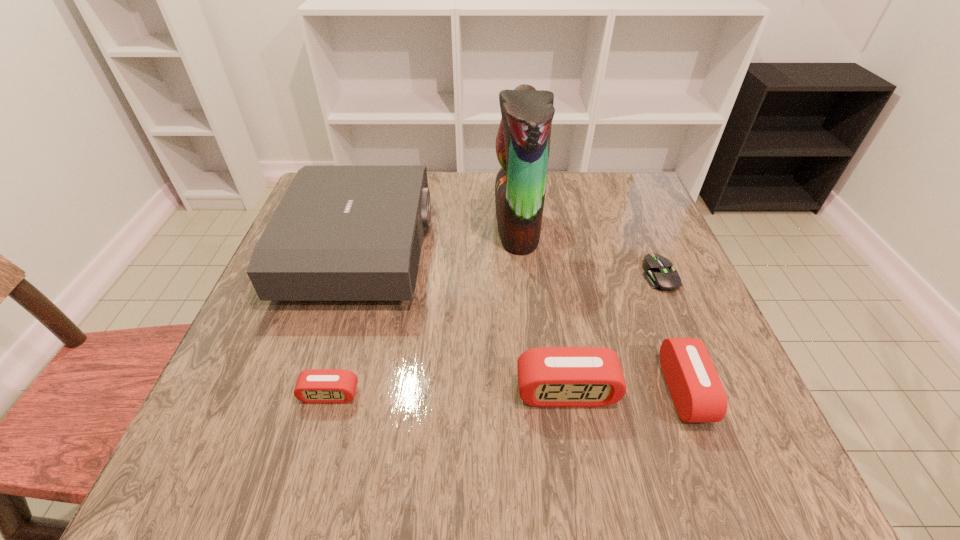
Identify the location of free space between the projector and the third shortest object. (523, 320).

The image size is (960, 540). I want to click on free spot between the shortest object and the third shortest object, so click(x=672, y=333).

You are a GUI agent. You are given a task and a screenshot of the screen. Output one action in this format:
    pyautogui.click(x=<x>, y=<y>)
    Task: Click on the unoccupied position between the second shortest alarm clock and the tallest object
    The height and width of the screenshot is (540, 960).
    Given the screenshot: What is the action you would take?
    (x=601, y=308)

Identify the location of vacant area that lies between the fifth shortest object and the tallest object. (439, 238).

In order to click on vacant area between the parrot and the second alarm clock from right to left in this screenshot , I will do `click(541, 308)`.

Where is `vacant area between the tallest object and the fifth shortest object`? vacant area between the tallest object and the fifth shortest object is located at coordinates (439, 238).

The image size is (960, 540). Identify the location of free area in between the second alarm clock from left to right and the parrot. (541, 308).

Where is `free space between the second tallest alarm clock and the shortest alarm clock`? The image size is (960, 540). free space between the second tallest alarm clock and the shortest alarm clock is located at coordinates (507, 392).

Find the location of a particular element. Image resolution: width=960 pixels, height=540 pixels. the fourth closest object relative to the projector is located at coordinates (697, 392).

Identify the location of object that is the second nearest to the second shortest alarm clock. The image size is (960, 540). (659, 274).